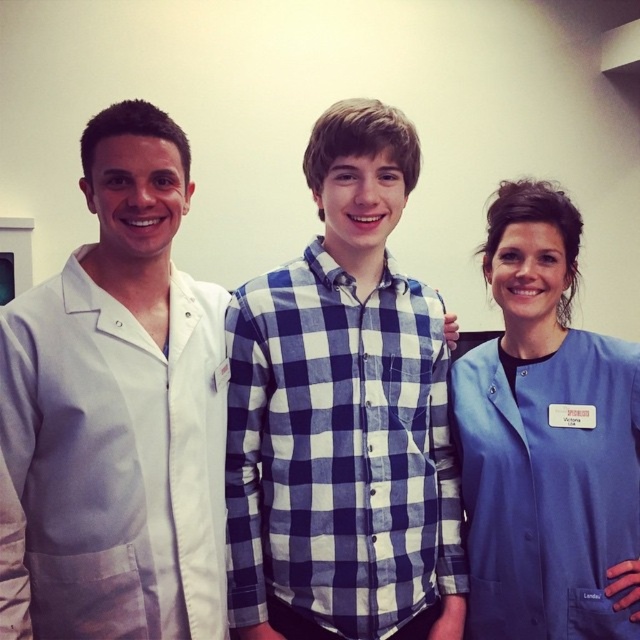
In the scene shown: You are a photographer setting up for a group photo in a healthcare setting. You need to position two subjects so that one is above the other. The subjects are wearing a white cotton lab coat at center and blue scrubs at center. Which clothing item should be placed higher to achieve this arrangement?

The blue scrubs at center should be placed higher since the white cotton lab coat at center is located below it in the original image.